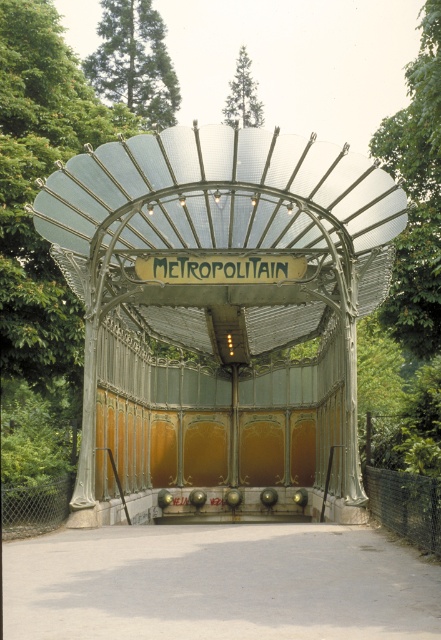
Question: Which is farther from the green leafy tree at upper center?

Choices:
 (A) gold metallic sign at center
 (B) metallic glass gazebo at center
 (C) green leafy tree at upper left
 (D) green leafy tree at upper right

Answer: (A)

Question: Can you confirm if green leafy tree at upper right is smaller than green leafy tree at upper center?

Choices:
 (A) no
 (B) yes

Answer: (A)

Question: Does green leafy tree at upper left appear on the left side of green leafy tree at upper center?

Choices:
 (A) yes
 (B) no

Answer: (A)

Question: Estimate the real-world distances between objects in this image. Which object is farther from the green leafy tree at upper left?

Choices:
 (A) gold metallic sign at center
 (B) metallic glass gazebo at center

Answer: (A)

Question: Does metallic glass gazebo at center appear on the right side of green leafy tree at upper center?

Choices:
 (A) yes
 (B) no

Answer: (B)

Question: Which object is the farthest from the green leafy tree at upper left?

Choices:
 (A) gold metallic sign at center
 (B) metallic glass gazebo at center
 (C) green leafy tree at upper right

Answer: (A)